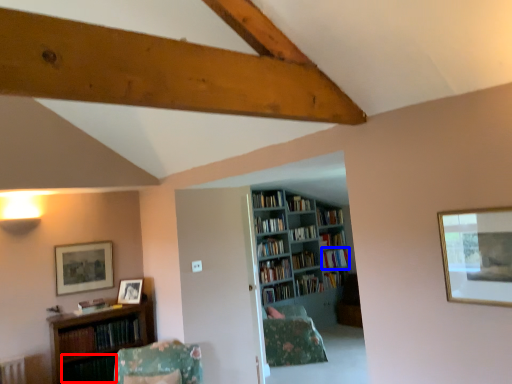
Question: Which object appears farthest to the camera in this image, book (highlighted by a red box) or book (highlighted by a blue box)?

Choices:
 (A) book
 (B) book

Answer: (B)